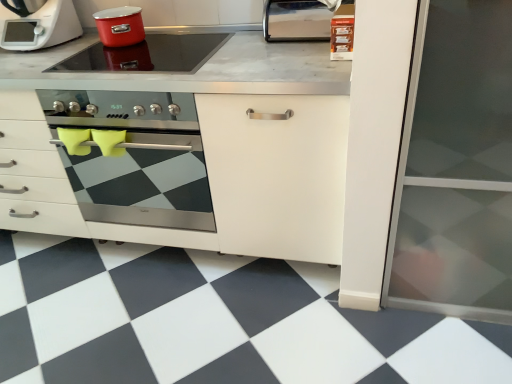
The image size is (512, 384). Identify the location of vacant area that lies between satin silver paper towel dispenser at upper right and smooth glass cooktop at upper center, the 2th kitchen appliance positioned from the top. (253, 51).